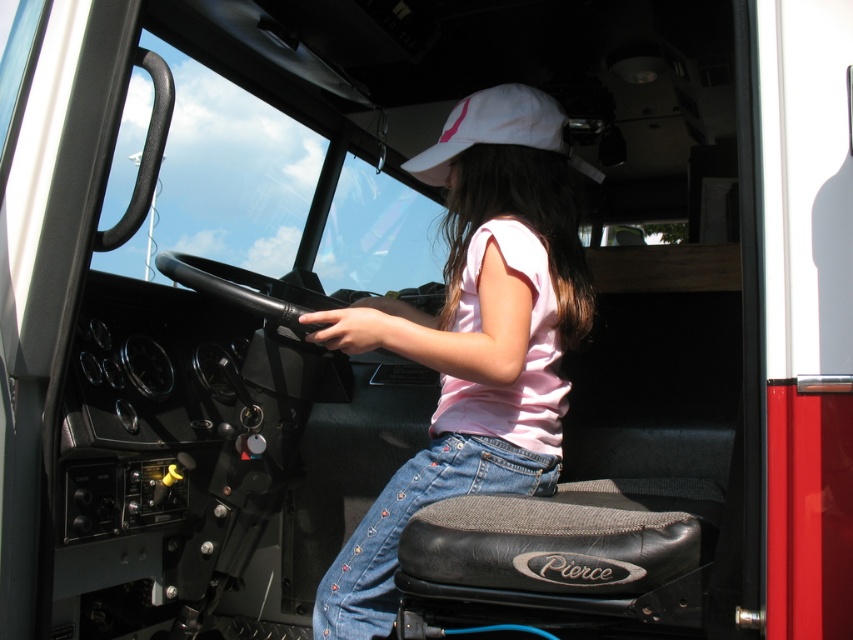
Question: Which of the following is the farthest from the observer?

Choices:
 (A) white fabric baseball cap at upper center
 (B) pink cotton shirt at center

Answer: (A)

Question: Which point is farther to the camera?

Choices:
 (A) white fabric baseball cap at upper center
 (B) pink cotton shirt at center

Answer: (A)

Question: Which point is farther from the camera taking this photo?

Choices:
 (A) (468, 230)
 (B) (554, 106)

Answer: (B)

Question: Can you confirm if pink cotton shirt at center is positioned to the left of white fabric baseball cap at upper center?

Choices:
 (A) no
 (B) yes

Answer: (B)

Question: In this image, where is pink cotton shirt at center located relative to white fabric baseball cap at upper center?

Choices:
 (A) left
 (B) right

Answer: (A)

Question: Observing the image, what is the correct spatial positioning of pink cotton shirt at center in reference to white fabric baseball cap at upper center?

Choices:
 (A) above
 (B) below

Answer: (B)